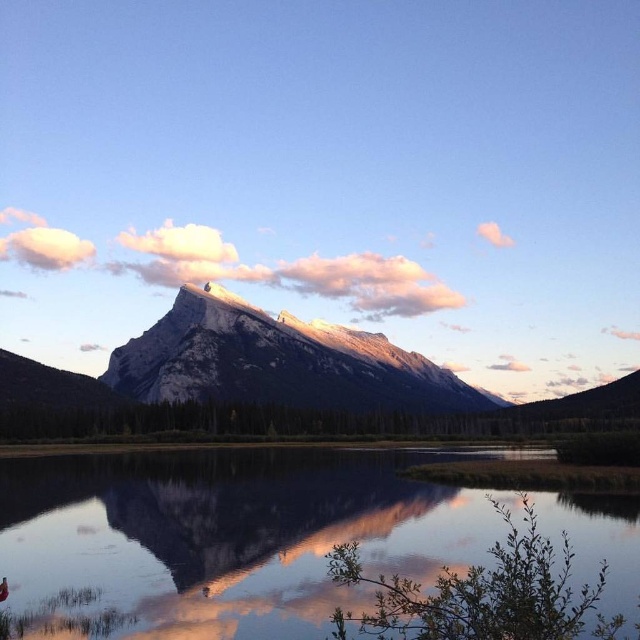
Question: From the image, what is the correct spatial relationship of snowy rock mountain at center in relation to smooth mountain reflection at center?

Choices:
 (A) right
 (B) left

Answer: (A)

Question: Does snowy rock mountain at center have a larger size compared to pink cotton cloud at upper right?

Choices:
 (A) no
 (B) yes

Answer: (B)

Question: Which object is the closest to the pink cotton cloud at upper right?

Choices:
 (A) smooth mountain reflection at center
 (B) snowy rock mountain at center

Answer: (B)

Question: Which of the following is the closest to the observer?

Choices:
 (A) (490, 230)
 (B) (227, 576)

Answer: (B)

Question: Can you confirm if transparent water at center is bigger than white fluffy cloud at upper center?

Choices:
 (A) no
 (B) yes

Answer: (B)

Question: Which point is farther to the camera?

Choices:
 (A) white fluffy cloud at upper center
 (B) transparent water at center

Answer: (A)